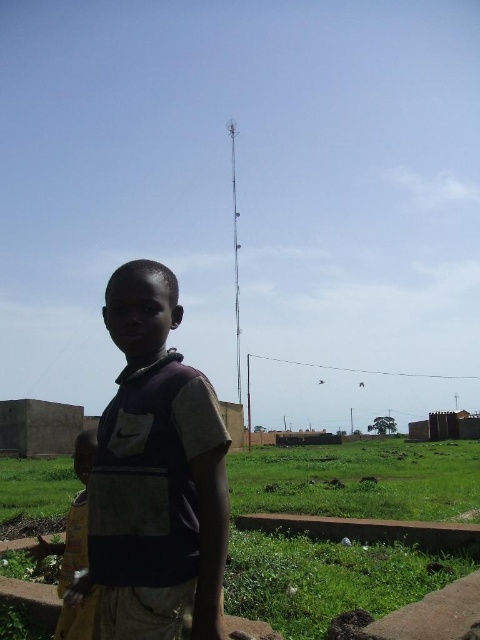
You are a photographer positioned at the camera location. You want to take a photo that includes both the point at coordinates point (188,563) and point (66,576). Since the camera has a limited depth of field, which point should you focus on to ensure both points are in focus?

You should focus on point (188,563) because it is closer to the camera than point (66,576). By focusing on the closer point, the depth of field will extend backward, potentially keeping both points in focus.

You are a photographer trying to capture a photo of the dark purple shirt at center and the yellow fabric at lower left. Which object should you focus on first to ensure both are in clear view?

The dark purple shirt at center is in front of the yellow fabric at lower left, so you should focus on the dark purple shirt at center first to ensure both are in clear view.